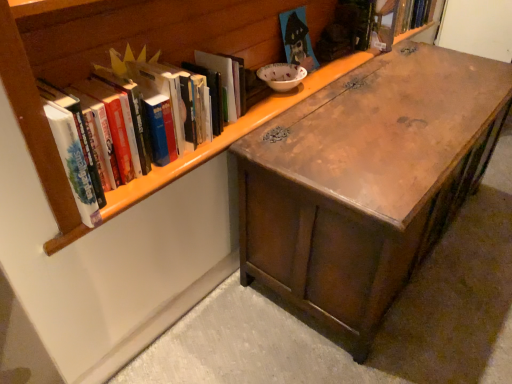
Question: From the image's perspective, is wooden chest at center above hardcover book at upper right, the 3th book from the bottom?

Choices:
 (A) no
 (B) yes

Answer: (A)

Question: From a real-world perspective, is wooden chest at center located higher than hardcover book at upper right, which ranks as the 1th book in top-to-bottom order?

Choices:
 (A) yes
 (B) no

Answer: (B)

Question: Is wooden chest at center taller than hardcover book at upper right, the 3th book from the left?

Choices:
 (A) no
 (B) yes

Answer: (B)

Question: Is hardcover book at upper right, the 3th book from the bottom, completely or partially inside wooden chest at center?

Choices:
 (A) yes
 (B) no

Answer: (B)

Question: Does wooden chest at center lie behind hardcover book at upper right, the first book from the back?

Choices:
 (A) no
 (B) yes

Answer: (A)

Question: Is wooden chest at center not within hardcover book at upper right, the 3th book from the bottom?

Choices:
 (A) no
 (B) yes

Answer: (B)

Question: Can you confirm if wooden house-shaped book at upper center, the second book viewed from the left, is bigger than wooden chest at center?

Choices:
 (A) no
 (B) yes

Answer: (A)

Question: From the image's perspective, would you say wooden house-shaped book at upper center, the 2th book positioned from the right, is positioned over wooden chest at center?

Choices:
 (A) no
 (B) yes

Answer: (B)

Question: Is wooden house-shaped book at upper center, which is counted as the 2th book, starting from the top, not near wooden chest at center?

Choices:
 (A) yes
 (B) no

Answer: (B)

Question: From the image's perspective, is wooden house-shaped book at upper center, the second book viewed from the left, below wooden chest at center?

Choices:
 (A) no
 (B) yes

Answer: (A)

Question: Is wooden house-shaped book at upper center, the 2th book positioned from the right, positioned before wooden chest at center?

Choices:
 (A) no
 (B) yes

Answer: (A)

Question: Considering the relative positions of wooden house-shaped book at upper center, which is counted as the 2th book, starting from the top, and wooden chest at center in the image provided, is wooden house-shaped book at upper center, which is counted as the 2th book, starting from the top, to the left of wooden chest at center from the viewer's perspective?

Choices:
 (A) yes
 (B) no

Answer: (A)

Question: Is there a large distance between wooden chest at center and white matte book at upper left, which appears as the 3th book when viewed from the right?

Choices:
 (A) no
 (B) yes

Answer: (A)